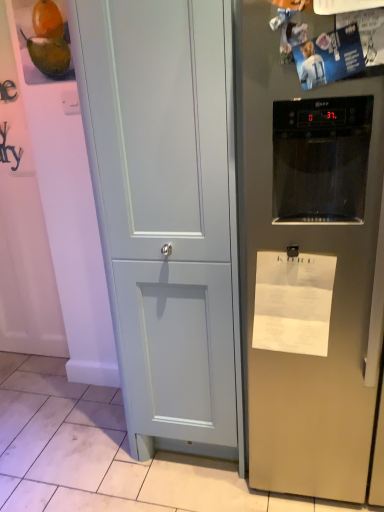
Question: Is white paper at right not near matte light blue cabinet at center?

Choices:
 (A) yes
 (B) no

Answer: (B)

Question: From a real-world perspective, is white paper at right on matte light blue cabinet at center?

Choices:
 (A) no
 (B) yes

Answer: (A)

Question: From the image's perspective, is white paper at right on top of matte light blue cabinet at center?

Choices:
 (A) no
 (B) yes

Answer: (A)

Question: Is white paper at right positioned with its back to matte light blue cabinet at center?

Choices:
 (A) yes
 (B) no

Answer: (B)

Question: Can you confirm if white paper at right is taller than matte light blue cabinet at center?

Choices:
 (A) yes
 (B) no

Answer: (B)

Question: In the image, is satin silver refrigerator at right on the left side or the right side of white paper at right?

Choices:
 (A) left
 (B) right

Answer: (B)

Question: Does point (279, 421) appear closer or farther from the camera than point (261, 270)?

Choices:
 (A) farther
 (B) closer

Answer: (A)

Question: From a real-world perspective, is satin silver refrigerator at right physically located above or below white paper at right?

Choices:
 (A) above
 (B) below

Answer: (A)

Question: Is satin silver refrigerator at right inside or outside of white paper at right?

Choices:
 (A) inside
 (B) outside

Answer: (B)

Question: From a real-world perspective, is matte light blue cabinet at center above or below satin silver refrigerator at right?

Choices:
 (A) above
 (B) below

Answer: (A)

Question: Considering the positions of matte light blue cabinet at center and satin silver refrigerator at right in the image, is matte light blue cabinet at center bigger or smaller than satin silver refrigerator at right?

Choices:
 (A) big
 (B) small

Answer: (B)

Question: Considering their positions, is matte light blue cabinet at center located in front of or behind satin silver refrigerator at right?

Choices:
 (A) front
 (B) behind

Answer: (B)

Question: Is point (102, 51) positioned closer to the camera than point (269, 293)?

Choices:
 (A) farther
 (B) closer

Answer: (B)

Question: Is point (220, 239) positioned closer to the camera than point (306, 324)?

Choices:
 (A) closer
 (B) farther

Answer: (B)

Question: Is matte light blue cabinet at center to the left or to the right of white paper at right in the image?

Choices:
 (A) right
 (B) left

Answer: (B)